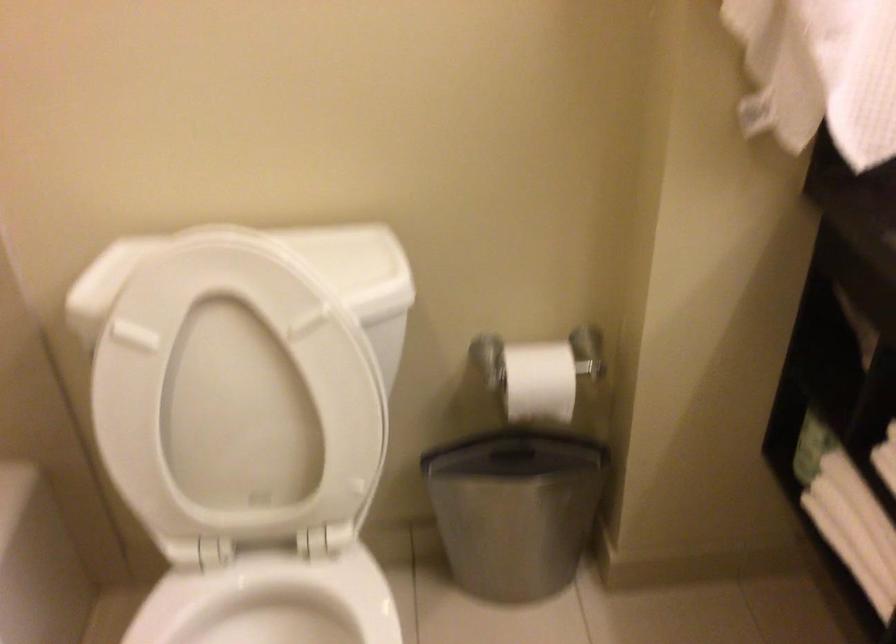
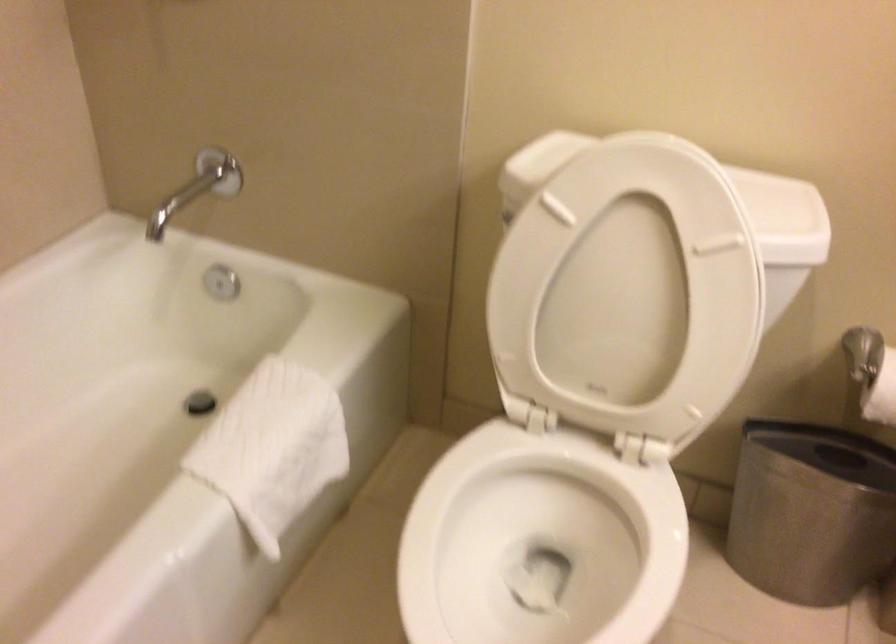
Locate, in the second image, the point that corresponds to point 514,395 in the first image.

(881, 393)